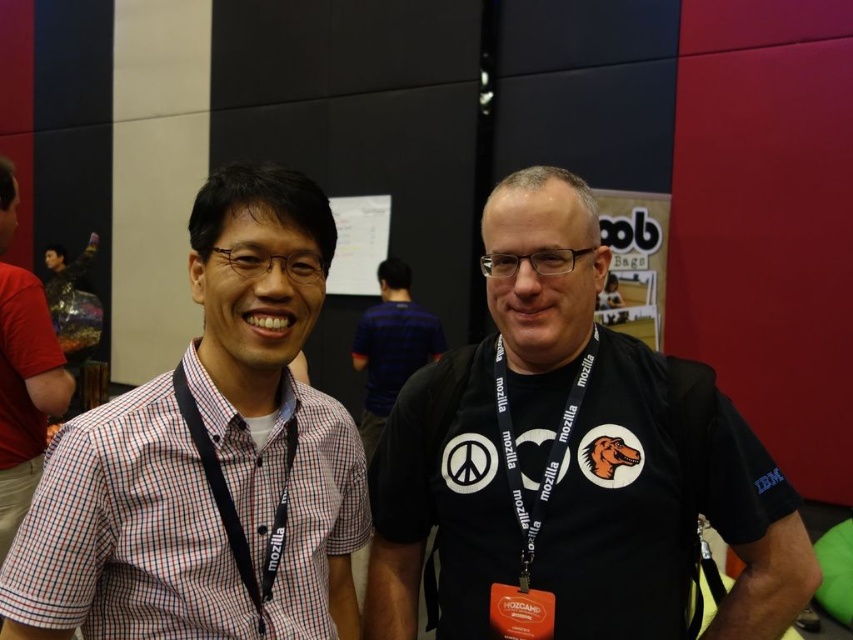
Does black matte t-shirt at center have a lesser height compared to blue striped shirt at center?

Correct, black matte t-shirt at center is not as tall as blue striped shirt at center.

Who is taller, black matte t-shirt at center or blue striped shirt at center?

With more height is blue striped shirt at center.

Is point (567, 236) farther from viewer compared to point (357, 349)?

No, (567, 236) is closer to viewer.

Where is `black matte t-shirt at center`? The width and height of the screenshot is (853, 640). black matte t-shirt at center is located at coordinates (567, 460).

Is black matte t-shirt at center below checkered shirt at left?

Yes, black matte t-shirt at center is below checkered shirt at left.

Is black matte t-shirt at center above checkered shirt at left?

No.

Locate an element on the screen. This screenshot has height=640, width=853. black matte t-shirt at center is located at coordinates (567, 460).

Is blue striped shirt at center to the right of black fabric lanyard at left from the viewer's perspective?

In fact, blue striped shirt at center is to the left of black fabric lanyard at left.

Does blue striped shirt at center have a greater height compared to black fabric lanyard at left?

Indeed, blue striped shirt at center has a greater height compared to black fabric lanyard at left.

This screenshot has width=853, height=640. Describe the element at coordinates (392, 346) in the screenshot. I see `blue striped shirt at center` at that location.

Identify the location of blue striped shirt at center. The height and width of the screenshot is (640, 853). (392, 346).